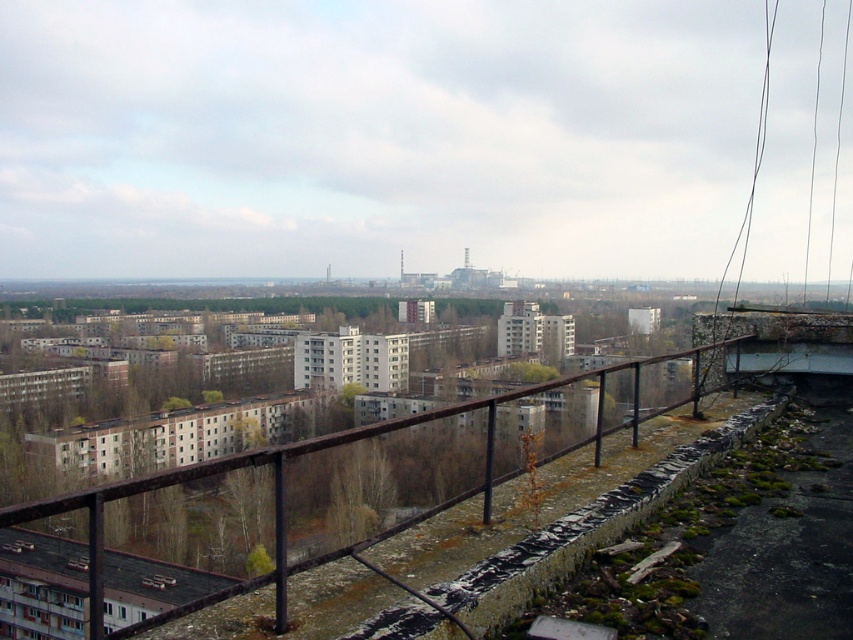
Is rusty metal railing at center bigger than black wire at upper right?

Actually, rusty metal railing at center might be smaller than black wire at upper right.

Between point (18, 506) and point (695, 372), which one is positioned behind?

The point (695, 372) is more distant.

Who is more forward, (93, 612) or (699, 374)?

Point (93, 612) is in front.

Image resolution: width=853 pixels, height=640 pixels. I want to click on rusty metal railing at center, so click(283, 496).